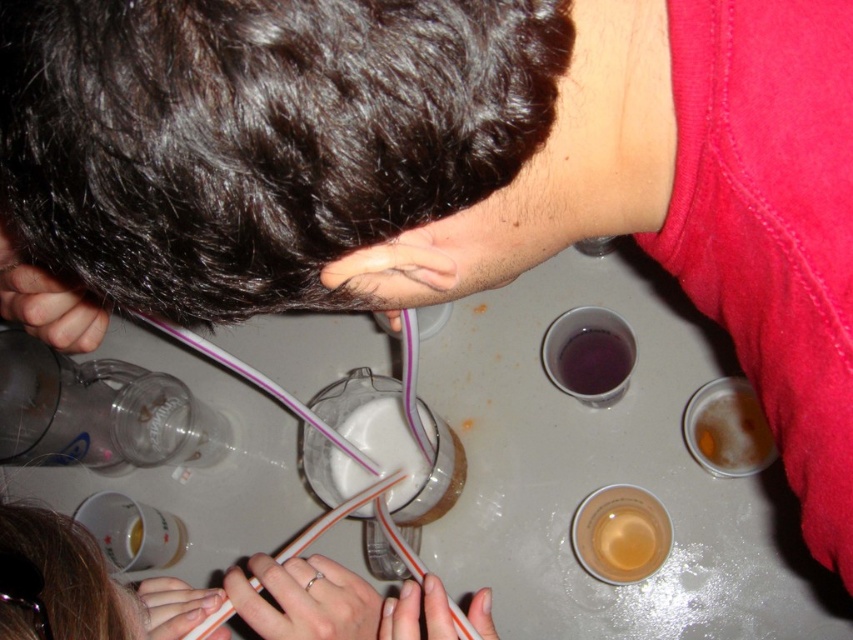
Which is more to the left, translucent plastic cup at upper center or white matte straws at lower left?

white matte straws at lower left is more to the left.

Does translucent plastic cup at upper center have a larger size compared to white matte straws at lower left?

Indeed, translucent plastic cup at upper center has a larger size compared to white matte straws at lower left.

Between point (550, 369) and point (144, 593), which one is positioned behind?

Point (550, 369)

Where is `translucent plastic cup at upper center`? The height and width of the screenshot is (640, 853). translucent plastic cup at upper center is located at coordinates (589, 355).

What do you see at coordinates (80, 586) in the screenshot?
I see `white plastic straw at lower center` at bounding box center [80, 586].

Does white plastic straw at lower center appear under silver metallic ring at lower center?

No, white plastic straw at lower center is not below silver metallic ring at lower center.

What are the coordinates of `white plastic straw at lower center` in the screenshot? It's located at (80, 586).

Where is `translucent plastic cup at lower center`? The image size is (853, 640). translucent plastic cup at lower center is located at coordinates (619, 532).